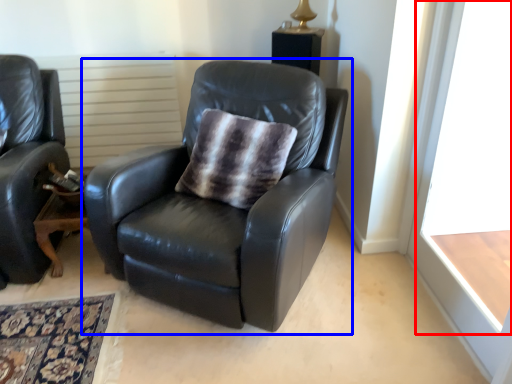
Question: Among these objects, which one is farthest to the camera, window frame (highlighted by a red box) or chair (highlighted by a blue box)?

Choices:
 (A) window frame
 (B) chair

Answer: (B)